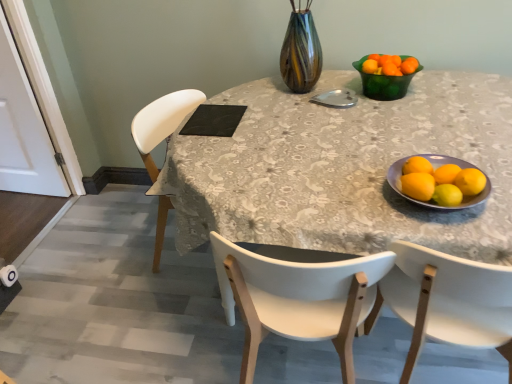
You are a GUI agent. You are given a task and a screenshot of the screen. Output one action in this format:
    pyautogui.click(x=<x>, y=<y>)
    Task: Click on the vacant area located to the right-hand side of green translucent bowl at upper right
    This screenshot has height=384, width=512.
    Given the screenshot: What is the action you would take?
    pyautogui.click(x=443, y=86)